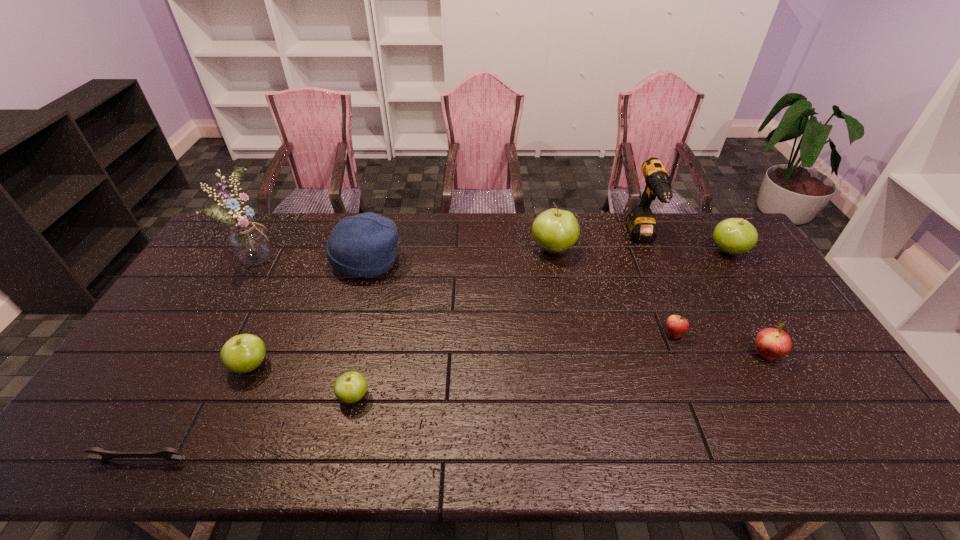
At what (x,y) coordinates should I click in order to perform the action: click on bouquet. Please return your answer as a coordinate pair (x, y). The width and height of the screenshot is (960, 540). Looking at the image, I should click on (249, 242).

Where is `the tallest object`? The width and height of the screenshot is (960, 540). the tallest object is located at coordinates (249, 242).

The image size is (960, 540). In order to click on the ninth shortest object in this screenshot , I will do `click(641, 225)`.

This screenshot has height=540, width=960. I want to click on drill, so click(641, 225).

Where is `skullcap`? This screenshot has width=960, height=540. skullcap is located at coordinates (364, 246).

At what (x,y) coordinates should I click in order to perform the action: click on the tallest apple. Please return your answer as a coordinate pair (x, y). The width and height of the screenshot is (960, 540). Looking at the image, I should click on (554, 230).

Locate an element on the screen. The image size is (960, 540). the fifth object from right to left is located at coordinates (554, 230).

This screenshot has width=960, height=540. Find the location of `the rightmost green apple`. the rightmost green apple is located at coordinates (733, 236).

Locate an element on the screen. Image resolution: width=960 pixels, height=540 pixels. the second biggest green apple is located at coordinates (733, 236).

Locate an element on the screen. This screenshot has height=540, width=960. the leftmost green apple is located at coordinates (243, 353).